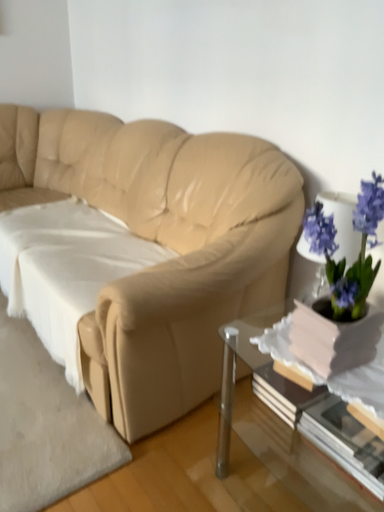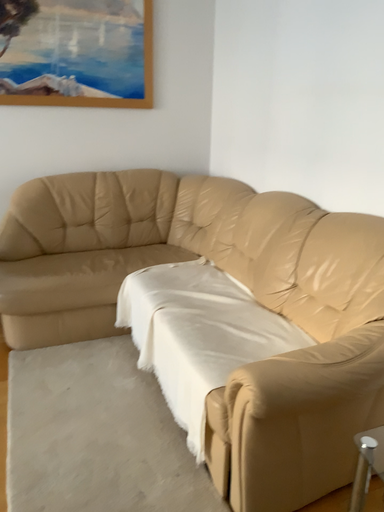
Question: How did the camera likely rotate when shooting the video?

Choices:
 (A) rotated downward
 (B) rotated upward

Answer: (B)